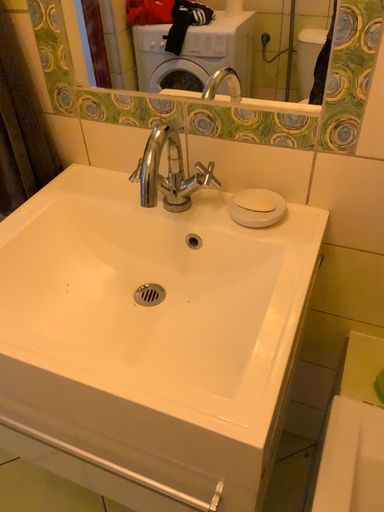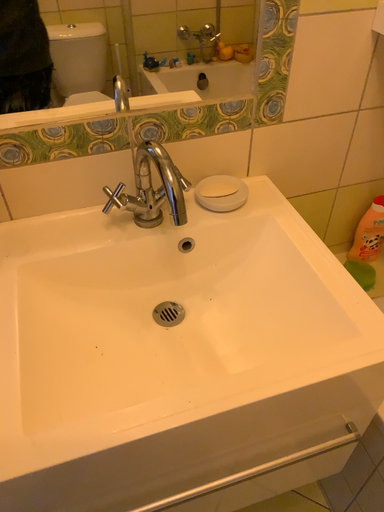
Question: Which way did the camera rotate in the video?

Choices:
 (A) rotated upward
 (B) rotated downward

Answer: (A)